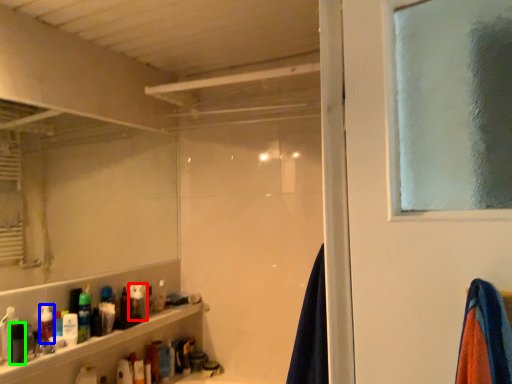
Question: Which is nearer to the toiletry (highlighted by a red box)? toiletry (highlighted by a blue box) or toiletry (highlighted by a green box).

Choices:
 (A) toiletry
 (B) toiletry

Answer: (A)